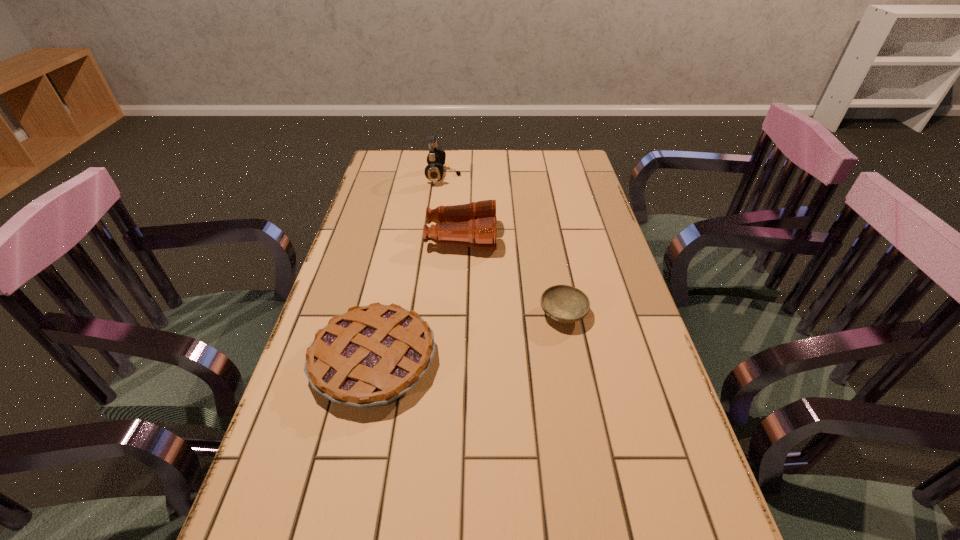
At what (x,y) coordinates should I click in order to perform the action: click on vacant space that satisfies the following two spatial constraints: 1. with the microphone on the side of the farthest object; 2. on the right side of the rightmost object. Please return your answer as a coordinate pair (x, y). Looking at the image, I should click on (427, 314).

This screenshot has height=540, width=960. Identify the location of free space in the image that satisfies the following two spatial constraints: 1. on the back side of the rightmost object; 2. through the lenses of the second farthest object. (548, 238).